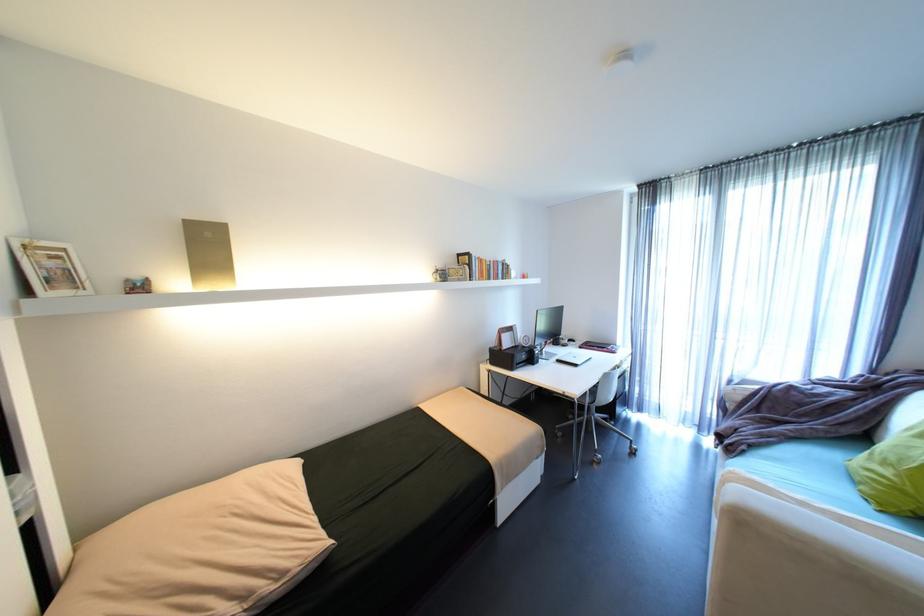
Image resolution: width=924 pixels, height=616 pixels. I want to click on chair sitting surface, so click(x=590, y=394).